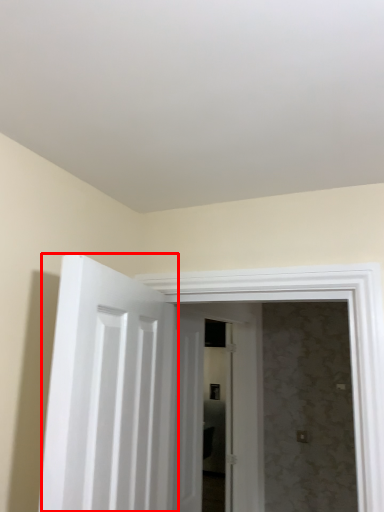
Question: Considering the relative positions of door (annotated by the red box) and door in the image provided, where is door (annotated by the red box) located with respect to the staircase?

Choices:
 (A) left
 (B) right

Answer: (A)